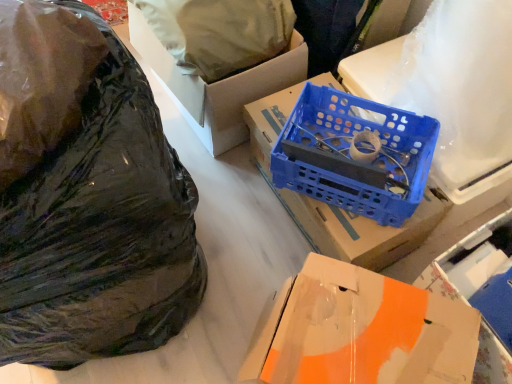
Question: From a real-world perspective, is blue plastic wire at center above or below white matte wrapping paper at upper right, acting as the 1th wrapping paper starting from the right?

Choices:
 (A) above
 (B) below

Answer: (B)

Question: Considering their positions, is blue plastic wire at center located in front of or behind white matte wrapping paper at upper right, arranged as the second wrapping paper when viewed from the left?

Choices:
 (A) behind
 (B) front

Answer: (A)

Question: Estimate the real-world distances between objects in this image. Which object is closer to the black matte plastic bag at left, which is counted as the 2th plastic bag, starting from the back?

Choices:
 (A) glossy plastic bag at left, acting as the 2th plastic bag starting from the front
 (B) white matte wrapping paper at upper right, acting as the 1th wrapping paper starting from the right
 (C) matte brown paper at upper center, the second wrapping paper from the right
 (D) blue plastic crate at center, arranged as the second box when viewed from the top
 (E) blue plastic wire at center

Answer: (A)

Question: Which of these objects is positioned farthest from the glossy plastic bag at left, the first plastic bag in the back-to-front sequence?

Choices:
 (A) black matte plastic bag at left, the first plastic bag in the front-to-back sequence
 (B) orange cardboard box at center, acting as the first box starting from the bottom
 (C) blue plastic wire at center
 (D) cardboard box at center, which ranks as the third box in bottom-to-top order
 (E) matte brown paper at upper center, the first wrapping paper in the left-to-right sequence

Answer: (B)